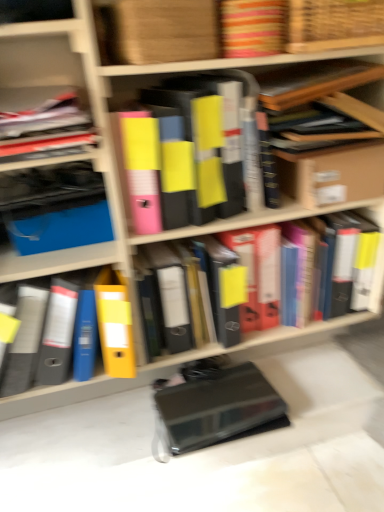
Question: Does yellow matte folder at center, arranged as the third book when ordered from the bottom, turn towards woven wood basket at upper center?

Choices:
 (A) no
 (B) yes

Answer: (A)

Question: Considering the relative positions of yellow matte folder at center, arranged as the third book when ordered from the bottom, and woven wood basket at upper center in the image provided, is yellow matte folder at center, arranged as the third book when ordered from the bottom, behind woven wood basket at upper center?

Choices:
 (A) no
 (B) yes

Answer: (B)

Question: From a real-world perspective, is yellow matte folder at center, arranged as the third book when ordered from the bottom, on top of woven wood basket at upper center?

Choices:
 (A) no
 (B) yes

Answer: (A)

Question: Can you confirm if yellow matte folder at center, arranged as the third book when ordered from the bottom, is positioned to the right of woven wood basket at upper center?

Choices:
 (A) no
 (B) yes

Answer: (A)

Question: Looking at their shapes, would you say wooden frame at upper right, which is the 2th book from top to bottom, is wider or thinner than yellow matte folder at center, acting as the 4th book starting from the top?

Choices:
 (A) wide
 (B) thin

Answer: (A)

Question: Considering the positions of wooden frame at upper right, marked as the 4th book in a bottom-to-top arrangement, and yellow matte folder at center, which ranks as the 2th book in bottom-to-top order, in the image, is wooden frame at upper right, marked as the 4th book in a bottom-to-top arrangement, taller or shorter than yellow matte folder at center, which ranks as the 2th book in bottom-to-top order,?

Choices:
 (A) short
 (B) tall

Answer: (A)

Question: Based on their sizes in the image, would you say wooden frame at upper right, which is the 2th book from top to bottom, is bigger or smaller than yellow matte folder at center, acting as the 4th book starting from the top?

Choices:
 (A) small
 (B) big

Answer: (A)

Question: Is wooden frame at upper right, marked as the 4th book in a bottom-to-top arrangement, to the left or to the right of yellow matte folder at center, acting as the 4th book starting from the top, in the image?

Choices:
 (A) left
 (B) right

Answer: (B)

Question: Relative to black matte book at lower center, is wooden frame at upper right, marked as the 4th book in a bottom-to-top arrangement, in front or behind?

Choices:
 (A) behind
 (B) front

Answer: (B)

Question: Is wooden frame at upper right, which is the 2th book from top to bottom, situated inside black matte book at lower center or outside?

Choices:
 (A) inside
 (B) outside

Answer: (B)

Question: In terms of width, does wooden frame at upper right, marked as the 4th book in a bottom-to-top arrangement, look wider or thinner when compared to black matte book at lower center?

Choices:
 (A) wide
 (B) thin

Answer: (B)

Question: From the image's perspective, is wooden frame at upper right, which is the 2th book from top to bottom, located above or below black matte book at lower center?

Choices:
 (A) above
 (B) below

Answer: (A)

Question: Does point (79, 283) appear closer or farther from the camera than point (377, 310)?

Choices:
 (A) farther
 (B) closer

Answer: (B)

Question: Considering the positions of yellow matte folder at center, the 1th book in the bottom-to-top sequence, and yellow matte folder at center, acting as the 4th book starting from the top, in the image, is yellow matte folder at center, the 1th book in the bottom-to-top sequence, bigger or smaller than yellow matte folder at center, acting as the 4th book starting from the top,?

Choices:
 (A) small
 (B) big

Answer: (A)